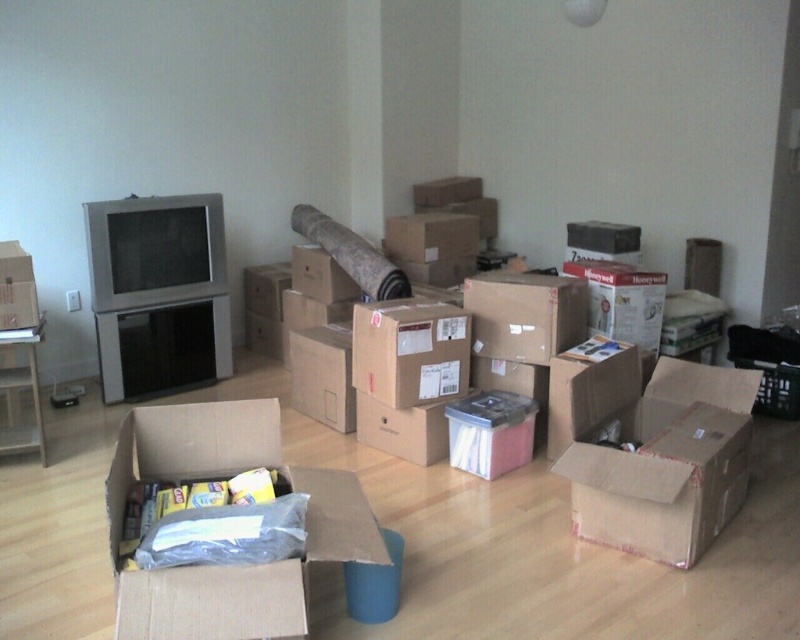
You are moving into a new apartment and need to place a 1.5 meter long sofa in the room. The sofa must be placed between the cardboard box at center and the matte cardboard box at left. Is there enough space between them to fit the sofa?

The distance between the cardboard box at center and the matte cardboard box at left is 1.44 meters, which is shorter than the 1.5 meter length of the sofa. Therefore, there isn not enough space to fit the sofa between them.